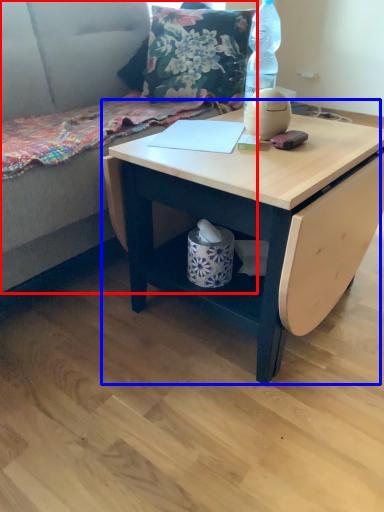
Question: Which object is closer to the camera taking this photo, couch (highlighted by a red box) or table (highlighted by a blue box)?

Choices:
 (A) couch
 (B) table

Answer: (A)